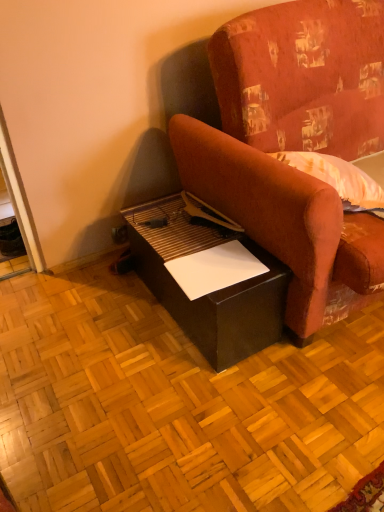
This screenshot has height=512, width=384. Find the location of `vacant region to the left of matte black table at lower center`. vacant region to the left of matte black table at lower center is located at coordinates (86, 328).